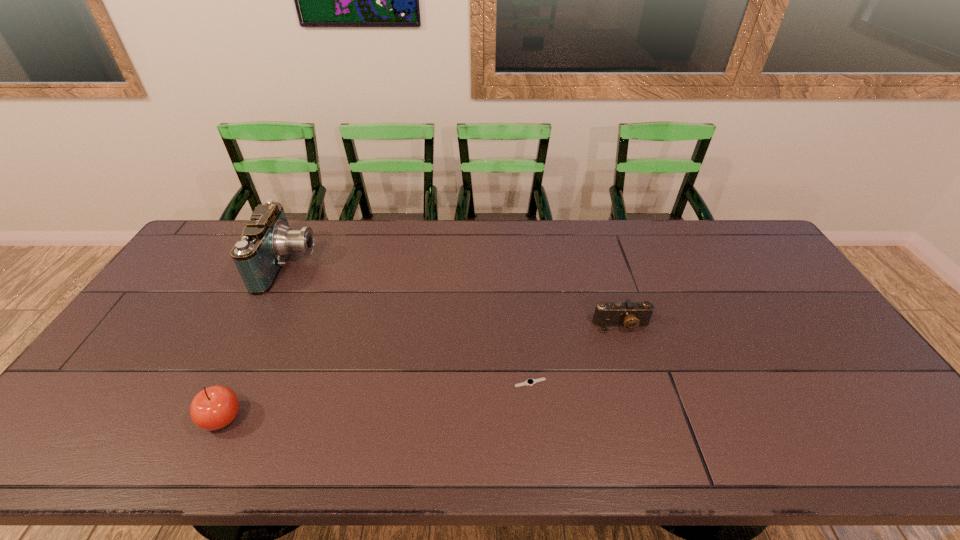
Where is `vacant point that satisfies the following two spatial constraints: 1. on the front-facing side of the farthest object; 2. on the left side of the watch`? This screenshot has width=960, height=540. vacant point that satisfies the following two spatial constraints: 1. on the front-facing side of the farthest object; 2. on the left side of the watch is located at coordinates (229, 383).

I want to click on free location that satisfies the following two spatial constraints: 1. on the front-facing side of the camcorder; 2. on the right side of the second tallest object, so click(x=212, y=418).

Find the location of `free space that satisfies the following two spatial constraints: 1. on the front-facing side of the apple; 2. on the right side of the farthest object`. free space that satisfies the following two spatial constraints: 1. on the front-facing side of the apple; 2. on the right side of the farthest object is located at coordinates (212, 418).

Where is `free spot that satisfies the following two spatial constraints: 1. on the front-facing side of the watch; 2. on the left side of the tallest object`? free spot that satisfies the following two spatial constraints: 1. on the front-facing side of the watch; 2. on the left side of the tallest object is located at coordinates (229, 383).

Identify the location of vacant space that satisfies the following two spatial constraints: 1. on the front-facing side of the tallest object; 2. on the right side of the nearest object. (212, 418).